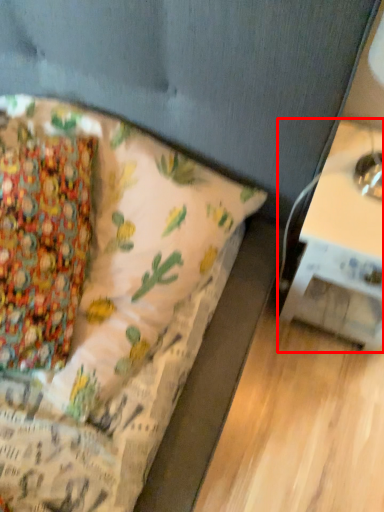
Question: Observing the image, what is the correct spatial positioning of table (annotated by the red box) in reference to bed?

Choices:
 (A) left
 (B) right

Answer: (B)